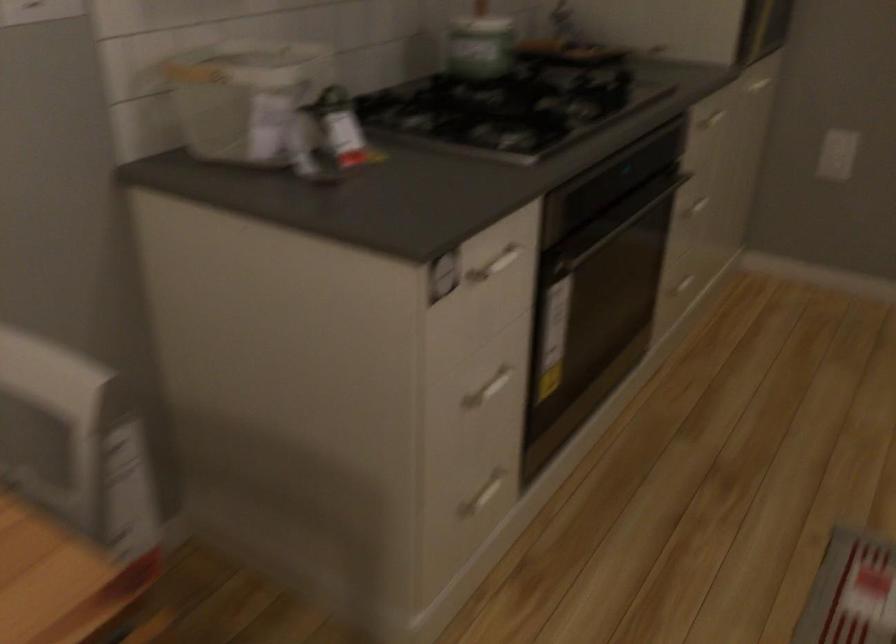
I want to click on oven door handle, so click(x=612, y=231).